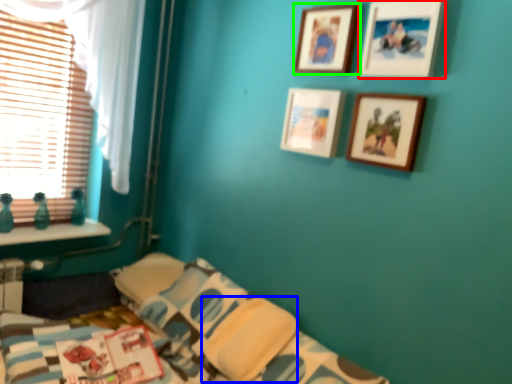
Question: Considering the real-world distances, which object is closest to picture frame (highlighted by a red box)? pillow (highlighted by a blue box) or picture frame (highlighted by a green box).

Choices:
 (A) pillow
 (B) picture frame

Answer: (B)